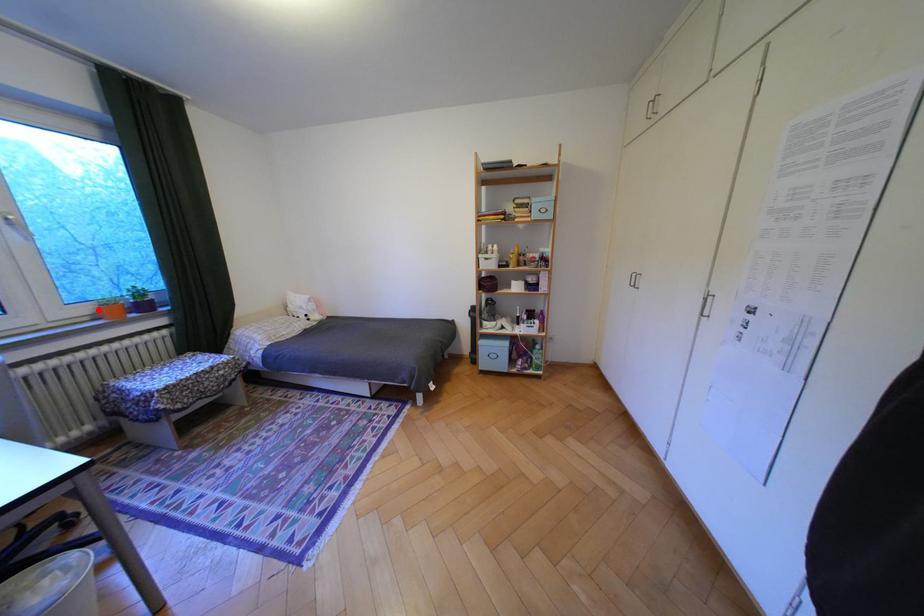
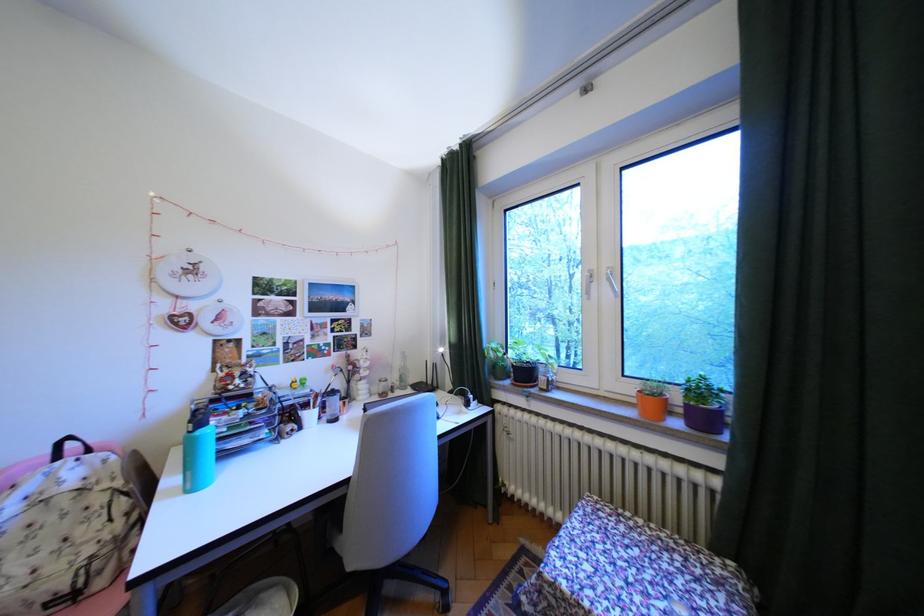
Find the pixel in the second image that matches the highlighted location in the first image.

(641, 390)